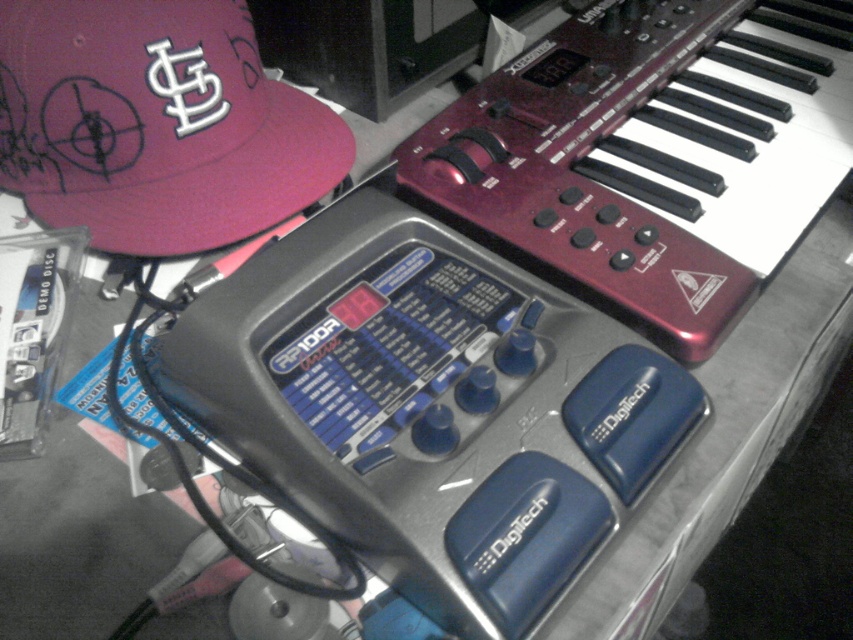
Question: Can you confirm if metallic red keyboard at upper right is thinner than matte pink cap at upper left?

Choices:
 (A) no
 (B) yes

Answer: (A)

Question: Does metallic red keyboard at upper right have a smaller size compared to matte pink cap at upper left?

Choices:
 (A) yes
 (B) no

Answer: (B)

Question: Does metallic red keyboard at upper right have a larger size compared to matte pink cap at upper left?

Choices:
 (A) yes
 (B) no

Answer: (A)

Question: Which point is farther to the camera?

Choices:
 (A) (329, 168)
 (B) (518, 81)

Answer: (B)

Question: Among these points, which one is nearest to the camera?

Choices:
 (A) (538, 250)
 (B) (44, 122)

Answer: (A)